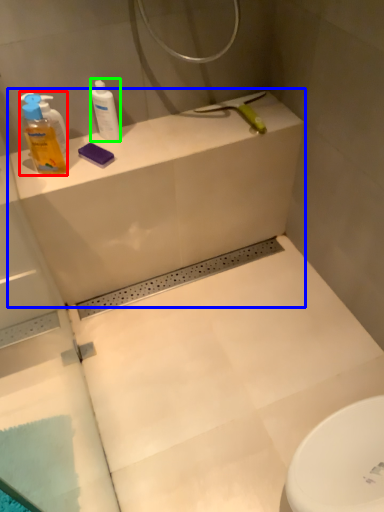
Question: Based on their relative distances, which object is nearer to cleaning product (highlighted by a red box)? Choose from counter top (highlighted by a blue box) and cleaning product (highlighted by a green box).

Choices:
 (A) counter top
 (B) cleaning product

Answer: (B)